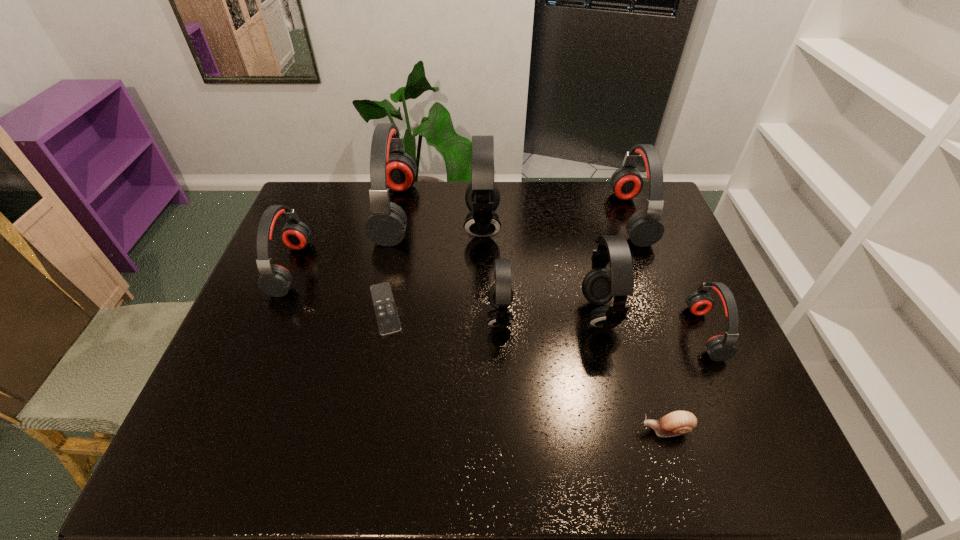
This screenshot has height=540, width=960. What are the coordinates of `the shortest earphone` in the screenshot? It's located at (720, 347).

Identify the location of the second shortest object. (675, 423).

The image size is (960, 540). What are the coordinates of `the nearest object` in the screenshot? It's located at (675, 423).

Find the location of a particular element. This screenshot has width=960, height=540. remote control is located at coordinates (386, 313).

Locate an element on the screen. The image size is (960, 540). vacant space located on the ear cups of the biggest red earphone is located at coordinates (467, 212).

This screenshot has height=540, width=960. I want to click on free space located on the ear cups of the biggest black earphone, so click(419, 225).

What are the coordinates of `free location located on the ear cups of the biggest black earphone` in the screenshot? It's located at (421, 225).

Where is `vacant space located on the ear cups of the biggest black earphone`? vacant space located on the ear cups of the biggest black earphone is located at coordinates (449, 225).

Locate an element on the screen. Image resolution: width=960 pixels, height=540 pixels. free spot located on the ear cups of the second biggest red earphone is located at coordinates (553, 218).

This screenshot has height=540, width=960. Find the location of `vacant area located 0.110m on the ear cups of the second biggest red earphone`. vacant area located 0.110m on the ear cups of the second biggest red earphone is located at coordinates (584, 218).